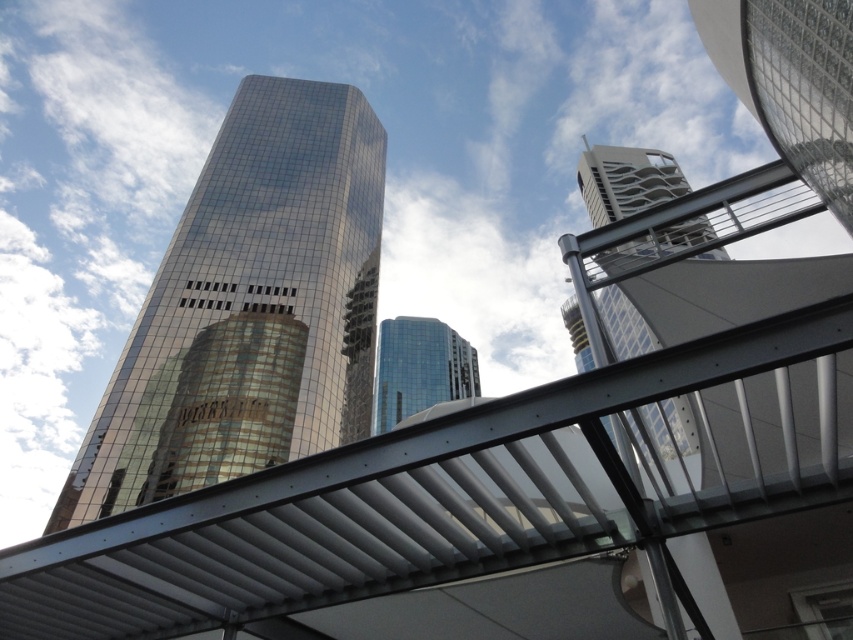
You are an architect analyzing the urban layout. You notice the shiny glass skyscraper at center and the glossy glass building at center. Which one is located to the left in the scene?

The shiny glass skyscraper at center is positioned on the left side of the glossy glass building at center, so it is located to the left in the scene.

You are standing at the point marked as point (248, 308) in the image. What is the nearest object to you?

The nearest object to you is the shiny glass skyscraper at center located at point (248, 308).